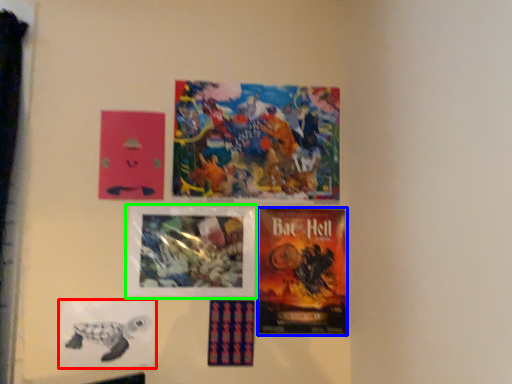
Question: Which object is positioned closest to poster (highlighted by a red box)? Select from poster (highlighted by a blue box) and poster (highlighted by a green box).

Choices:
 (A) poster
 (B) poster

Answer: (B)